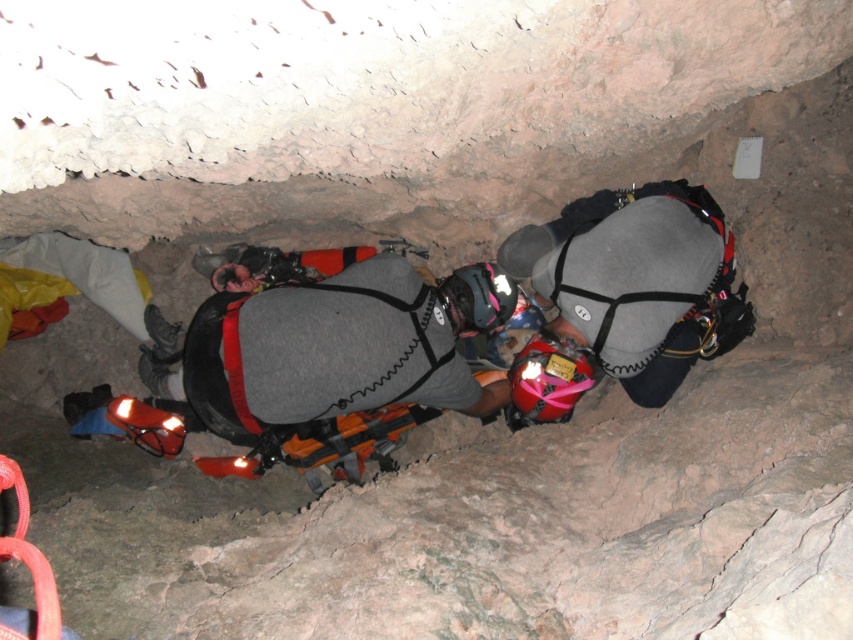
Is gray matte vest at center to the left of gray fabric helmet at center from the viewer's perspective?

Correct, you'll find gray matte vest at center to the left of gray fabric helmet at center.

Between gray matte vest at center and gray fabric helmet at center, which one has less height?

With less height is gray matte vest at center.

Where is `gray matte vest at center`? Image resolution: width=853 pixels, height=640 pixels. gray matte vest at center is located at coordinates 341,346.

Identify the location of gray matte vest at center. (341, 346).